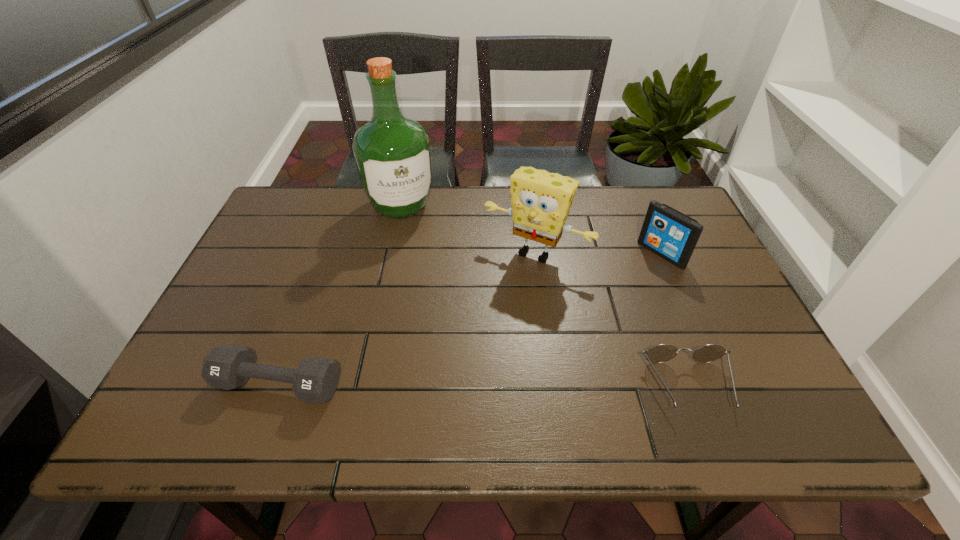
Find the location of a particular element. Image resolution: width=960 pixels, height=540 pixels. dumbbell is located at coordinates 315,380.

Image resolution: width=960 pixels, height=540 pixels. I want to click on the shortest object, so click(x=660, y=353).

This screenshot has width=960, height=540. What are the coordinates of `sponge` in the screenshot? It's located at (540, 200).

Image resolution: width=960 pixels, height=540 pixels. Find the location of `the third object from left to right`. the third object from left to right is located at coordinates (540, 200).

Find the location of a particular element. This screenshot has width=960, height=540. the farthest object is located at coordinates (392, 153).

You are a GUI agent. You are given a task and a screenshot of the screen. Output one action in this format:
    pyautogui.click(x=<x>, y=<y>)
    Task: Click on the liquor
    The image size is (960, 540).
    Given the screenshot: What is the action you would take?
    pyautogui.click(x=392, y=153)

Find the location of `iPod`. iPod is located at coordinates (672, 235).

The width and height of the screenshot is (960, 540). Identify the location of vacant space located 0.220m on the right of the dumbbell. (444, 384).

Identify the location of vacant space located on the face of the third object from right to left. Image resolution: width=960 pixels, height=540 pixels. (485, 314).

Identify the location of free space located on the face of the third object from right to left. This screenshot has height=540, width=960. (439, 384).